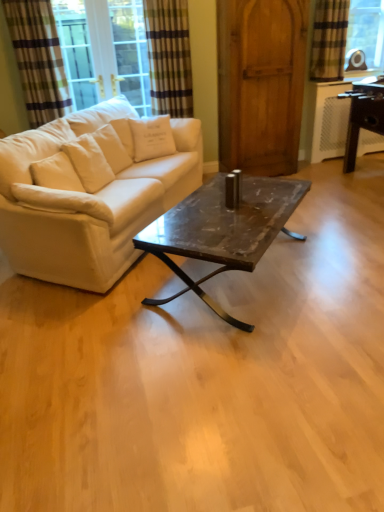
What is the approximate width of clear glass window at upper left?

clear glass window at upper left is 8.56 inches wide.

I want to click on marble/black metal coffee table at center, so click(222, 230).

Measure the distance between point (49, 224) and camera.

The depth of point (49, 224) is 8.13 feet.

The width and height of the screenshot is (384, 512). What do you see at coordinates (152, 137) in the screenshot? I see `white cotton pillow at upper left, positioned as the 1th pillow in right-to-left order` at bounding box center [152, 137].

Measure the distance between point [345,24] and camera.

13.61 feet.

At what (x,y) coordinates should I click in order to perform the action: click on striped fabric curtain at upper left, which appears as the first curtain when viewed from the left. Please return your answer as a coordinate pair (x, y). Looking at the image, I should click on (38, 59).

From the picture: How much space does striped fabric curtain at upper left, which appears as the first curtain when viewed from the left, occupy horizontally?

5.54 inches.

The image size is (384, 512). Identify the location of green striped curtain at upper left, the second curtain from the left. (169, 57).

Identify the location of clear glass window at upper left. The height and width of the screenshot is (512, 384). (104, 50).

From a real-world perspective, which object rests below the other?

wooden barn door at center.

Is plaid fabric curtain at upper right, arranged as the third curtain when viewed from the left, looking in the opposite direction of wooden barn door at center?

plaid fabric curtain at upper right, arranged as the third curtain when viewed from the left, is not turned away from wooden barn door at center.

Is plaid fabric curtain at upper right, arranged as the third curtain when viewed from the left, positioned beyond the bounds of wooden barn door at center?

Absolutely, plaid fabric curtain at upper right, arranged as the third curtain when viewed from the left, is external to wooden barn door at center.

Is the depth of clear glass window at upper left less than that of white fabric pillow at left, the 2th pillow viewed from the back?

No, clear glass window at upper left is further to the viewer.

Could you tell me if clear glass window at upper left is turned towards white fabric pillow at left, the 1th pillow viewed from the left?

Yes, clear glass window at upper left is turned towards white fabric pillow at left, the 1th pillow viewed from the left.

Could you measure the distance between clear glass window at upper left and white fabric pillow at left, which is the 1th pillow from front to back?

A distance of 6.92 feet exists between clear glass window at upper left and white fabric pillow at left, which is the 1th pillow from front to back.

From the picture: Is clear glass window at upper left with white fabric pillow at left, the 2th pillow viewed from the back?

No, clear glass window at upper left is not with white fabric pillow at left, the 2th pillow viewed from the back.

You are a GUI agent. You are given a task and a screenshot of the screen. Output one action in this format:
    pyautogui.click(x=<x>, y=<y>)
    Task: Click on the studio couch on the left side of marble/black metal coffee table at center
    The width and height of the screenshot is (384, 512).
    Given the screenshot: What is the action you would take?
    pyautogui.click(x=90, y=192)

How far apart are white fabric couch at left and marble/black metal coffee table at center?

white fabric couch at left is 25.72 inches away from marble/black metal coffee table at center.

How many degrees apart are the facing directions of white fabric couch at left and marble/black metal coffee table at center?

They differ by 4.72 degrees in their facing directions.

Considering the relative sizes of white fabric couch at left and marble/black metal coffee table at center in the image provided, is white fabric couch at left thinner than marble/black metal coffee table at center?

In fact, white fabric couch at left might be wider than marble/black metal coffee table at center.

From the image's perspective, is clear glass window at upper left positioned above or below green striped curtain at upper left, which appears as the 2th curtain when viewed from the right?

clear glass window at upper left is situated higher than green striped curtain at upper left, which appears as the 2th curtain when viewed from the right, in the image.

Which is more to the left, clear glass window at upper left or green striped curtain at upper left, the second curtain from the left?

clear glass window at upper left.

How distant is clear glass window at upper left from green striped curtain at upper left, which appears as the 2th curtain when viewed from the right?

clear glass window at upper left and green striped curtain at upper left, which appears as the 2th curtain when viewed from the right, are 23.71 inches apart.

Is clear glass window at upper left aimed at green striped curtain at upper left, which appears as the 2th curtain when viewed from the right?

No, clear glass window at upper left does not turn towards green striped curtain at upper left, which appears as the 2th curtain when viewed from the right.

Looking at this image, can you confirm if white fabric couch at left is shorter than green striped curtain at upper left, which appears as the 2th curtain when viewed from the right?

Yes, white fabric couch at left is shorter than green striped curtain at upper left, which appears as the 2th curtain when viewed from the right.

Can you confirm if white fabric couch at left is positioned to the right of green striped curtain at upper left, which appears as the 2th curtain when viewed from the right?

No.

Can you tell me how much white fabric couch at left and green striped curtain at upper left, the second curtain from the left, differ in facing direction?

The facing directions of white fabric couch at left and green striped curtain at upper left, the second curtain from the left, are 55.3 degrees apart.

Is white fabric couch at left aimed at green striped curtain at upper left, which appears as the 2th curtain when viewed from the right?

No.

How many degrees apart are the facing directions of plaid fabric curtain at upper right, which is the 1th curtain from right to left, and white cotton pillow at upper left, acting as the second pillow starting from the front?

plaid fabric curtain at upper right, which is the 1th curtain from right to left, and white cotton pillow at upper left, acting as the second pillow starting from the front, are facing 0.962 degrees away from each other.

Is white cotton pillow at upper left, positioned as the 1th pillow in right-to-left order, inside plaid fabric curtain at upper right, which is the 1th curtain from right to left?

No, white cotton pillow at upper left, positioned as the 1th pillow in right-to-left order, is not surrounded by plaid fabric curtain at upper right, which is the 1th curtain from right to left.

Who is bigger, plaid fabric curtain at upper right, which is the 1th curtain from right to left, or white cotton pillow at upper left, positioned as the second pillow in bottom-to-top order?

With larger size is plaid fabric curtain at upper right, which is the 1th curtain from right to left.

Does plaid fabric curtain at upper right, arranged as the third curtain when viewed from the left, have a greater width compared to white cotton pillow at upper left, acting as the second pillow starting from the front?

In fact, plaid fabric curtain at upper right, arranged as the third curtain when viewed from the left, might be narrower than white cotton pillow at upper left, acting as the second pillow starting from the front.

Which point is more distant from viewer, (282,128) or (30,18)?

Point (282,128)

In the image, is wooden barn door at center positioned in front of or behind striped fabric curtain at upper left, which appears as the 3th curtain when viewed from the right?

In the image, wooden barn door at center appears behind striped fabric curtain at upper left, which appears as the 3th curtain when viewed from the right.

From a real-world perspective, which object rests below the other?

wooden barn door at center.

Where is `barn door that appears below the plaid fabric curtain at upper right, which is the 1th curtain from right to left (from a real-world perspective)`? This screenshot has width=384, height=512. barn door that appears below the plaid fabric curtain at upper right, which is the 1th curtain from right to left (from a real-world perspective) is located at coordinates (261, 84).

Starting from the clear glass window at upper left, which pillow is the 2nd one in front? Please provide its 2D coordinates.

[(62, 201)]

From the image, which object appears to be nearer to marble/black metal coffee table at center, plaid fabric curtain at upper right, arranged as the third curtain when viewed from the left, or striped fabric curtain at upper left, which appears as the first curtain when viewed from the left?

The object closer to marble/black metal coffee table at center is striped fabric curtain at upper left, which appears as the first curtain when viewed from the left.

From the image, which object appears to be nearer to white fabric pillow at left, the 1th pillow viewed from the left, white fabric couch at left or green striped curtain at upper left, which appears as the 2th curtain when viewed from the right?

white fabric couch at left is positioned closer to the anchor white fabric pillow at left, the 1th pillow viewed from the left.

Which object lies further to the anchor point striped fabric curtain at upper left, which appears as the 3th curtain when viewed from the right, clear glass window at upper left or marble/black metal coffee table at center?

marble/black metal coffee table at center is further to striped fabric curtain at upper left, which appears as the 3th curtain when viewed from the right.

From the image, which object appears to be farther from clear glass window at upper left, white fabric couch at left or white cotton pillow at upper left, positioned as the 1th pillow in right-to-left order?

Based on the image, white fabric couch at left appears to be further to clear glass window at upper left.

From the image, which object appears to be nearer to white cotton pillow at upper left, which is the second pillow in left-to-right order, plaid fabric curtain at upper right, which is the 1th curtain from right to left, or wooden barn door at center?

Among the two, wooden barn door at center is located nearer to white cotton pillow at upper left, which is the second pillow in left-to-right order.

Which object lies further to the anchor point wooden barn door at center, white fabric couch at left or white fabric pillow at left, which is the 1th pillow from front to back?

white fabric pillow at left, which is the 1th pillow from front to back.

Based on their spatial positions, is striped fabric curtain at upper left, which appears as the 3th curtain when viewed from the right, or plaid fabric curtain at upper right, arranged as the third curtain when viewed from the left, further from white fabric couch at left?

The object further to white fabric couch at left is plaid fabric curtain at upper right, arranged as the third curtain when viewed from the left.

When comparing their distances from plaid fabric curtain at upper right, which is the 1th curtain from right to left, does striped fabric curtain at upper left, which appears as the first curtain when viewed from the left, or white fabric couch at left seem further?

The object further to plaid fabric curtain at upper right, which is the 1th curtain from right to left, is striped fabric curtain at upper left, which appears as the first curtain when viewed from the left.

Locate an element on the screen. The width and height of the screenshot is (384, 512). studio couch between striped fabric curtain at upper left, which appears as the first curtain when viewed from the left, and plaid fabric curtain at upper right, arranged as the third curtain when viewed from the left, from left to right is located at coordinates (90, 192).

Find the location of a particular element. The height and width of the screenshot is (512, 384). studio couch between marble/black metal coffee table at center and wooden barn door at center from front to back is located at coordinates (90, 192).

Locate an element on the screen. studio couch between marble/black metal coffee table at center and clear glass window at upper left along the z-axis is located at coordinates (90, 192).

Locate an element on the screen. This screenshot has width=384, height=512. pillow located between white fabric couch at left and plaid fabric curtain at upper right, which is the 1th curtain from right to left, in the left-right direction is located at coordinates (152, 137).